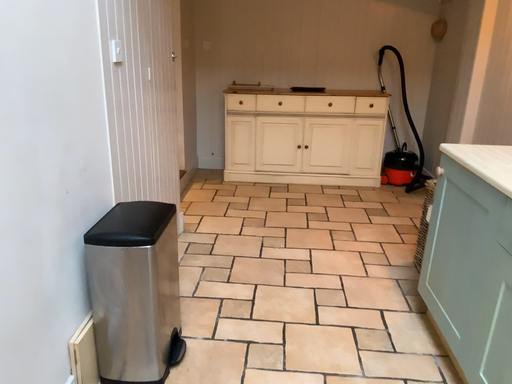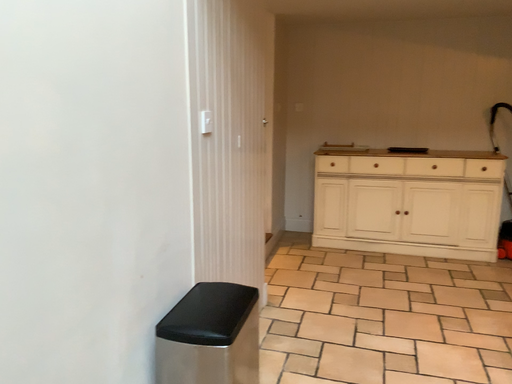
Question: Which way did the camera rotate in the video?

Choices:
 (A) rotated upward
 (B) rotated downward

Answer: (A)